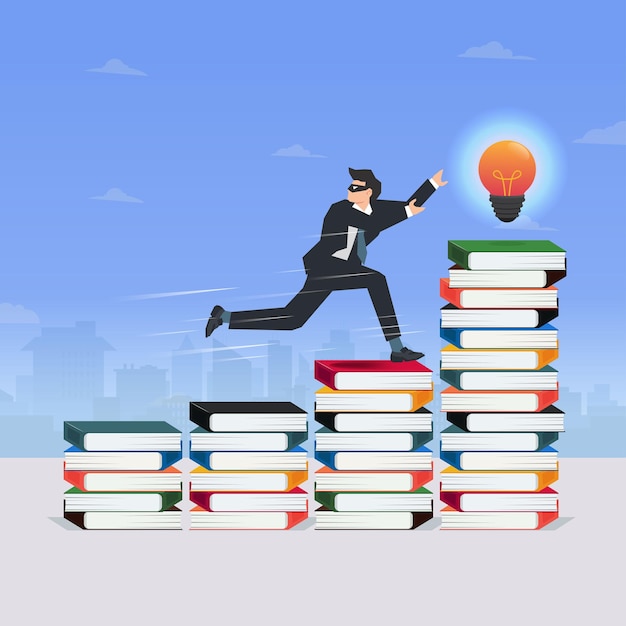
The width and height of the screenshot is (626, 626). I want to click on book with black coveres, so click(x=74, y=519), click(x=202, y=414), click(x=419, y=518), click(x=331, y=426), click(x=461, y=426), click(x=546, y=322).